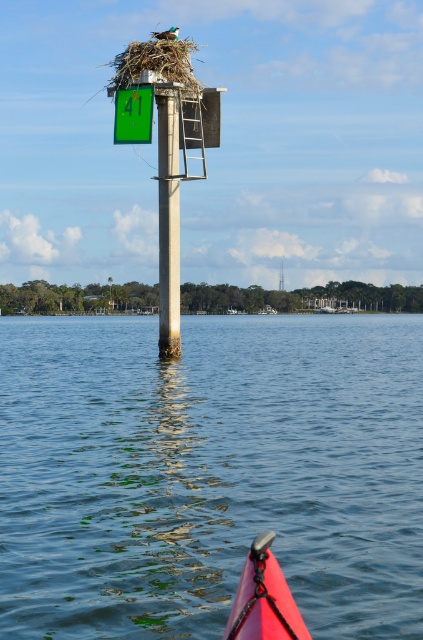
You are a maintenance worker needing to reach the top of the concrete pole at center to inspect the bird nest. The ladder is attached to the pole. Can you step onto the blue water at center to climb the ladder?

The blue water at center is located below the concrete pole at center, so you cannot step onto the blue water at center to climb the ladder because it is underneath the pole.

You are a birdwatcher standing on the dock and want to observe the blue water at center. Where should you look to see it?

You should look at point (208,472) to see the blue water at center.